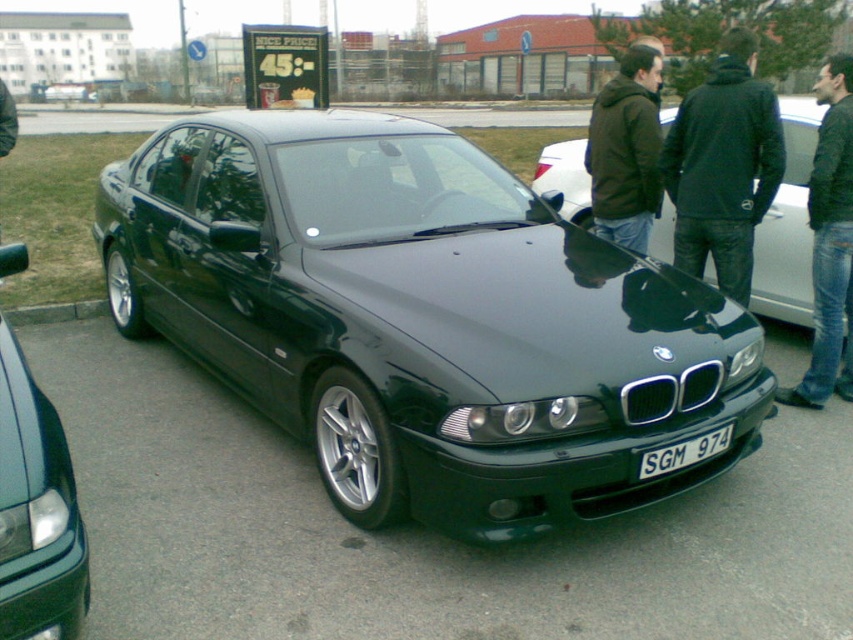
Which of these two, metallic dark green car at center or green metallic car at left, stands shorter?

green metallic car at left

Which is more to the left, metallic dark green car at center or green metallic car at left?

Positioned to the left is green metallic car at left.

The width and height of the screenshot is (853, 640). Identify the location of metallic dark green car at center. (422, 320).

Between point (19, 541) and point (67, 316), which one is positioned behind?

The point (67, 316) is behind.

The width and height of the screenshot is (853, 640). What are the coordinates of `green metallic car at left` in the screenshot? It's located at (36, 509).

Identify the location of green metallic car at left. The image size is (853, 640). (36, 509).

Between green metallic car at left and dark green leather jacket at center, which one is positioned higher?

Positioned higher is dark green leather jacket at center.

Does green metallic car at left appear over dark green leather jacket at center?

Actually, green metallic car at left is below dark green leather jacket at center.

This screenshot has width=853, height=640. I want to click on green metallic car at left, so click(36, 509).